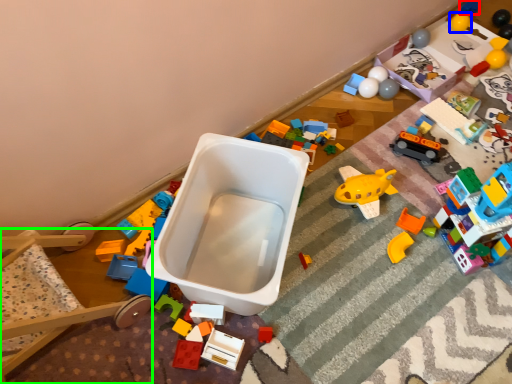
Question: Which object is positioned farthest from toy (highlighted by a red box)? Select from toy (highlighted by a blue box) and bunk bed (highlighted by a green box).

Choices:
 (A) toy
 (B) bunk bed

Answer: (B)